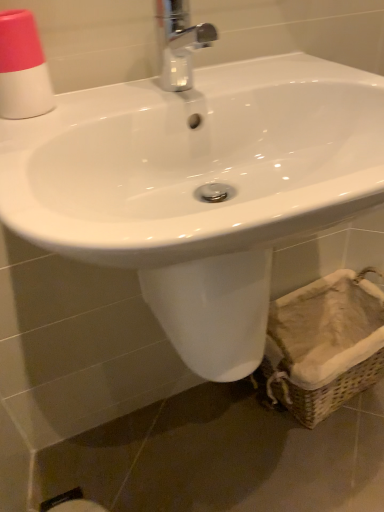
Find the location of `spots to the right of chrome metallic faucet at upper center`. spots to the right of chrome metallic faucet at upper center is located at coordinates pos(276,80).